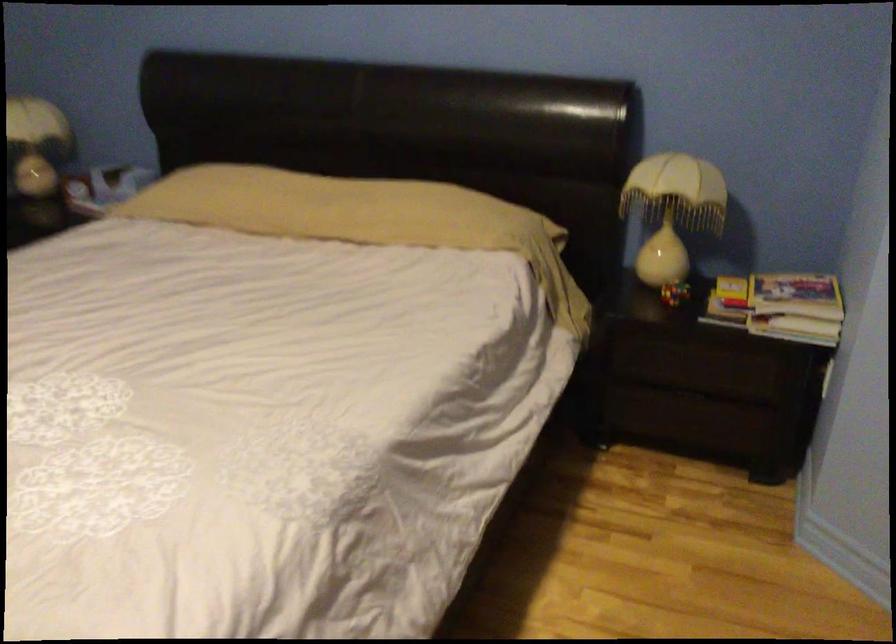
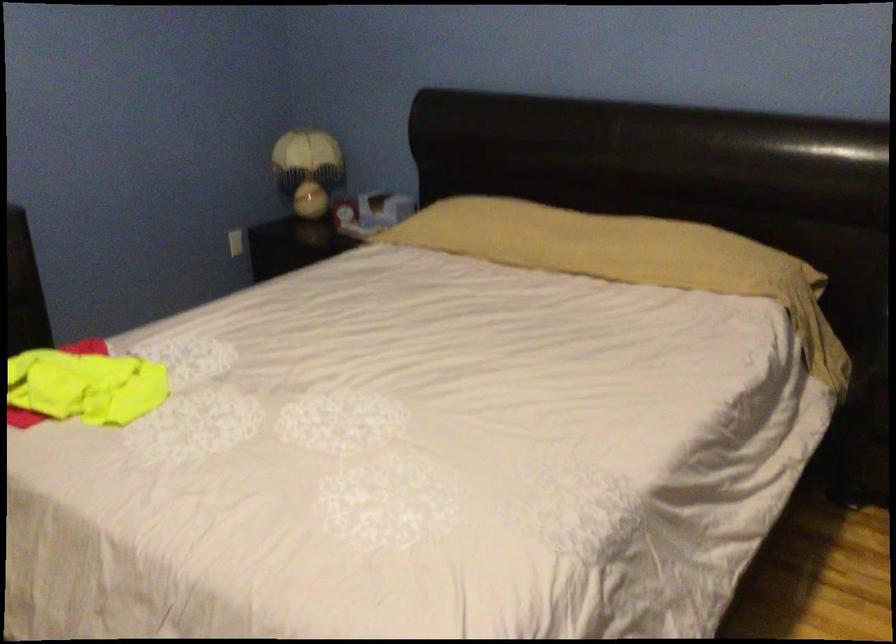
What movement of the cameraman would produce the second image?

The movement direction of the cameraman is left, backward.